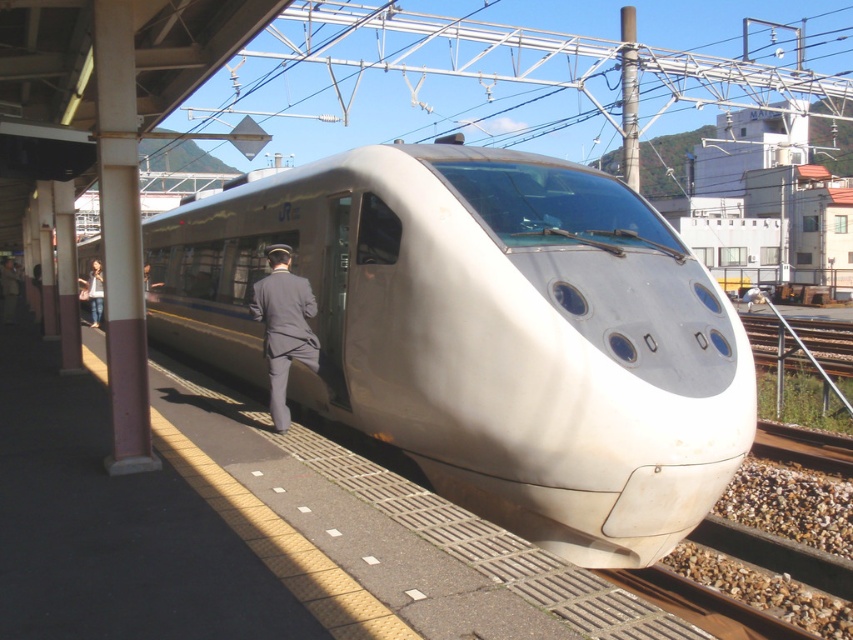
Question: Estimate the real-world distances between objects in this image. Which object is farther from the dark gray uniform at center?

Choices:
 (A) denim jacket at left
 (B) white glossy train at center

Answer: (A)

Question: Is white glossy train at center wider than denim jacket at left?

Choices:
 (A) no
 (B) yes

Answer: (B)

Question: Which of the following is the closest to the observer?

Choices:
 (A) (96, 300)
 (B) (276, 400)

Answer: (B)

Question: Among these points, which one is nearest to the camera?

Choices:
 (A) (260, 314)
 (B) (100, 314)
 (C) (312, 244)

Answer: (A)

Question: Can you confirm if dark gray uniform at center is positioned to the left of denim jacket at left?

Choices:
 (A) no
 (B) yes

Answer: (A)

Question: Can you confirm if white glossy train at center is wider than dark gray uniform at center?

Choices:
 (A) yes
 (B) no

Answer: (A)